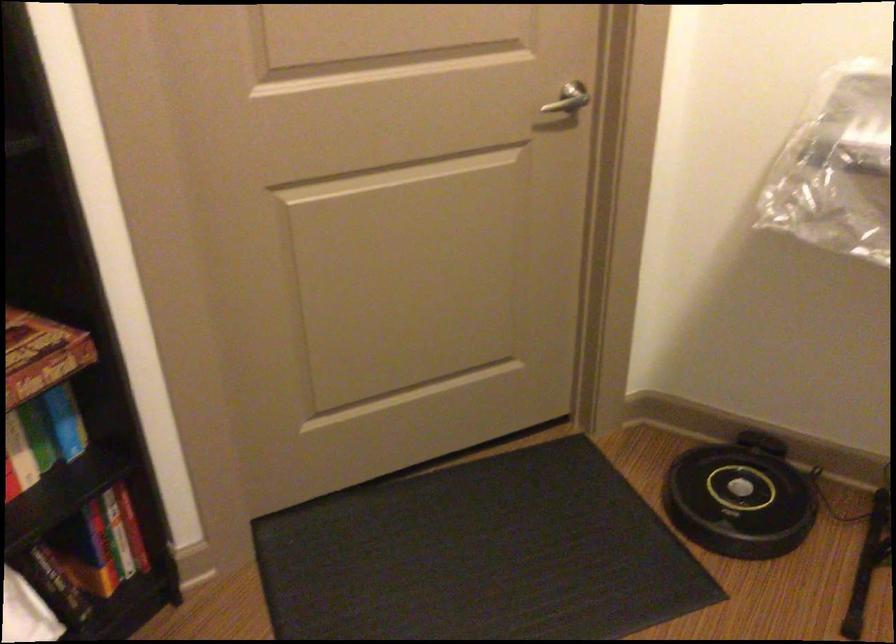
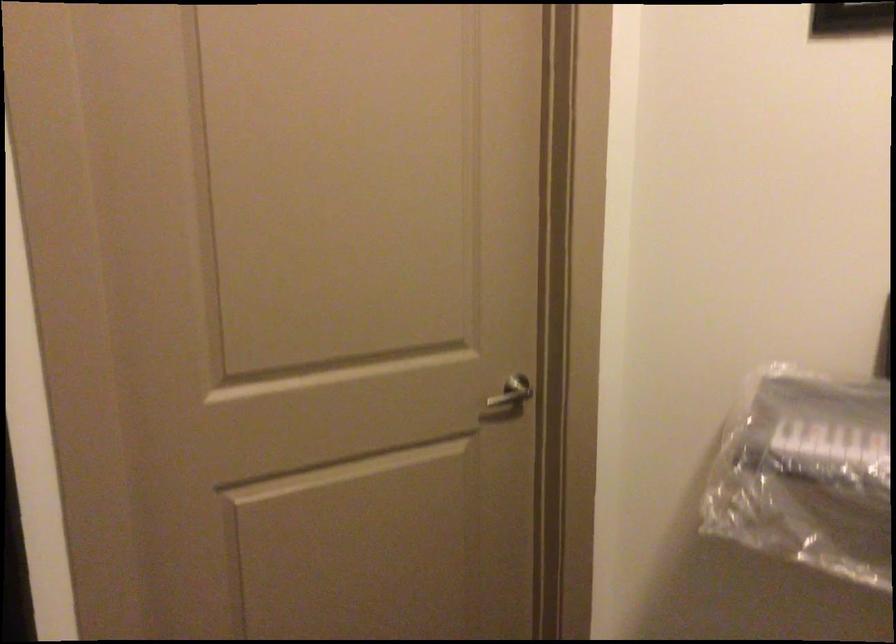
Question: The first image is from the beginning of the video and the second image is from the end. How did the camera likely rotate when shooting the video?

Choices:
 (A) Left
 (B) Right
 (C) Up
 (D) Down

Answer: (C)